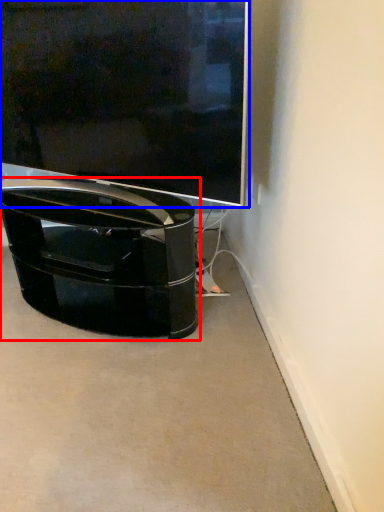
Question: Which point is further to the camera, furniture (highlighted by a red box) or television (highlighted by a blue box)?

Choices:
 (A) furniture
 (B) television

Answer: (A)